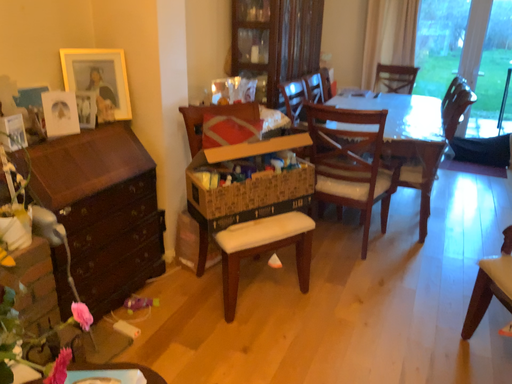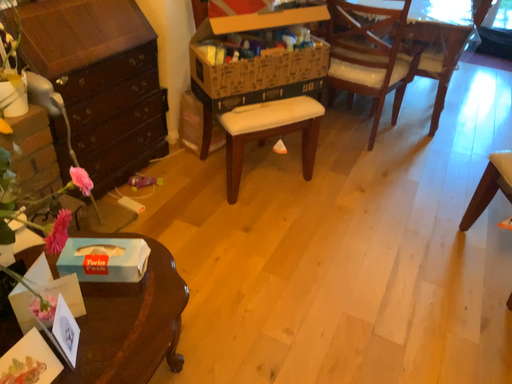
Question: Which way did the camera rotate in the video?

Choices:
 (A) rotated downward
 (B) rotated upward

Answer: (A)